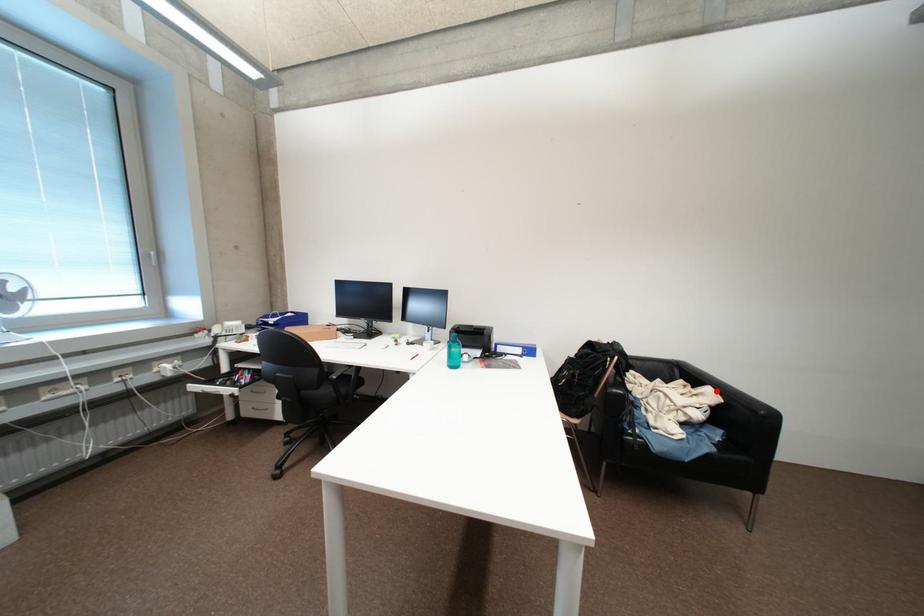
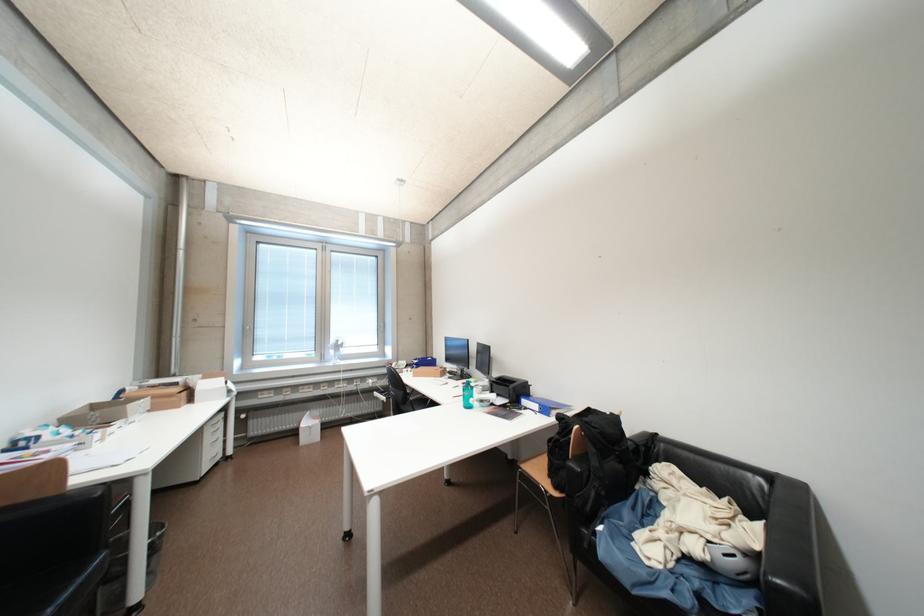
Question: I am providing you with two images of the same scene from different viewpoints. Given a red point in image1, look at the same physical point in image2. Is it:

Choices:
 (A) Closer to the viewpoint
 (B) Farther from the viewpoint

Answer: (A)